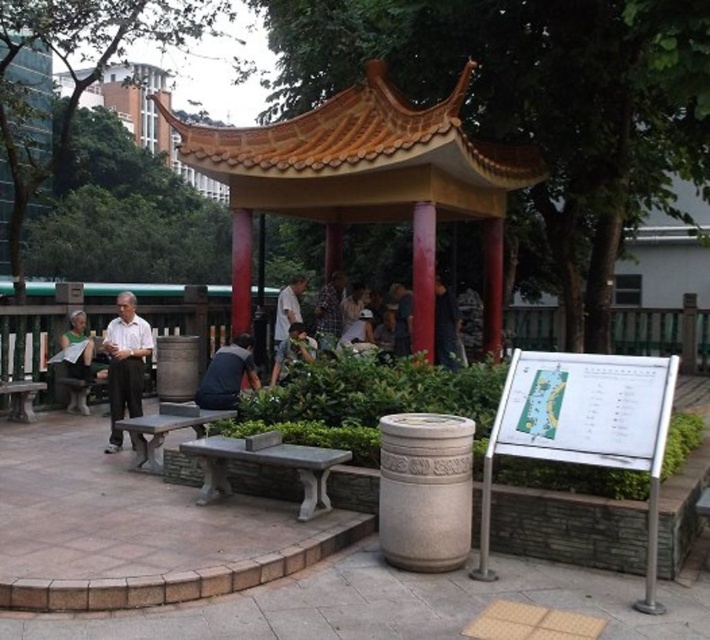
You are standing at the entrance of the pavilion and want to locate the red polished wood pillar at center. What are the coordinates of it?

The coordinates of the red polished wood pillar at center are at point [422,276].

You are planning to place a 6.5 feet long wooden bench in the park. You want to place it between the stone bench at center and the white matte shirt at center. Will there be enough space for the bench?

The distance between the stone bench at center and the white matte shirt at center is 6.60 feet. Since the wooden bench is 6.5 feet long, there is enough space to place it between them.

You are standing at the entrance of the traditional Chinese pavilion with a curved roof. You want to sit on the smooth gray bench at center. Which direction should you walk to reach it?

You should walk forward from the entrance of the pavilion towards the smooth gray bench at center located at point coordinates 0.673 on the x axis and 0.232 on the y axis.